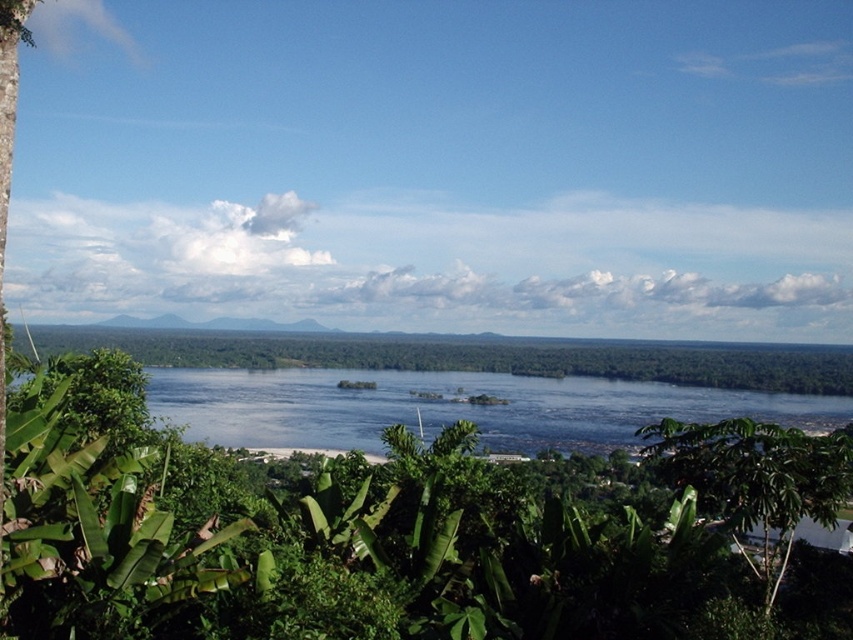
Is point (520, 573) farther from camera compared to point (207, 401)?

No.

Which of these two, green leafy tree at lower left or transparent water at center, stands taller?

green leafy tree at lower left is taller.

What do you see at coordinates (381, 531) in the screenshot? The image size is (853, 640). I see `green leafy tree at lower left` at bounding box center [381, 531].

This screenshot has height=640, width=853. In order to click on green leafy tree at lower left in this screenshot , I will do `click(381, 531)`.

Is transparent water at center smaller than green leafy tree at center?

Indeed, transparent water at center has a smaller size compared to green leafy tree at center.

Which is behind, point (408, 381) or point (635, 378)?

Point (635, 378)

Where is `transparent water at center`? transparent water at center is located at coordinates (451, 406).

Does green leafy tree at lower left have a lesser height compared to green leafy tree at center?

No, green leafy tree at lower left is not shorter than green leafy tree at center.

Does green leafy tree at lower left lie behind green leafy tree at center?

No.

Does point (461, 634) come farther from viewer compared to point (451, 365)?

No, it is not.

The width and height of the screenshot is (853, 640). Identify the location of green leafy tree at lower left. [x=381, y=531].